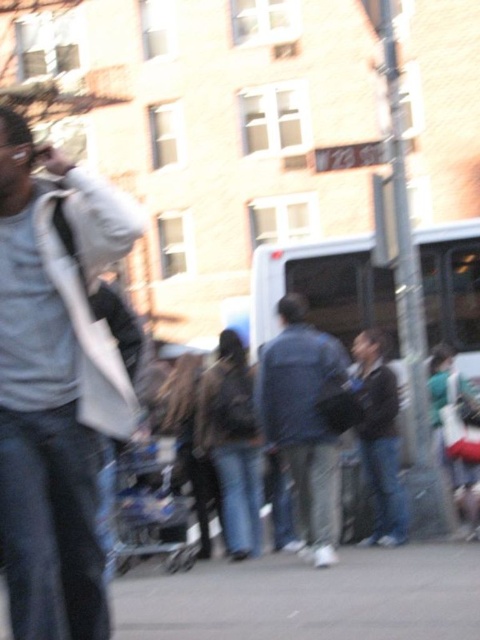
Describe the element at coordinates (56, 384) in the screenshot. I see `white fabric bag at left` at that location.

Which of these two, white fabric bag at left or gray asphalt pavement at lower center, stands shorter?

With less height is gray asphalt pavement at lower center.

Describe the element at coordinates (56, 384) in the screenshot. I see `white fabric bag at left` at that location.

You are a GUI agent. You are given a task and a screenshot of the screen. Output one action in this format:
    pyautogui.click(x=<x>, y=<y>)
    Task: Click on the white fabric bag at left
    Image resolution: width=480 pixels, height=640 pixels.
    Given the screenshot: What is the action you would take?
    pyautogui.click(x=56, y=384)

Does white fabric bag at left have a lesser width compared to denim jacket at center?

Yes.

Who is shorter, white fabric bag at left or denim jacket at center?

With less height is white fabric bag at left.

Image resolution: width=480 pixels, height=640 pixels. Describe the element at coordinates (56, 384) in the screenshot. I see `white fabric bag at left` at that location.

You are a GUI agent. You are given a task and a screenshot of the screen. Output one action in this format:
    pyautogui.click(x=<x>, y=<y>)
    Task: Click on the white fabric bag at left
    Image resolution: width=480 pixels, height=640 pixels.
    Given the screenshot: What is the action you would take?
    (56, 384)

Is gray asphalt pavement at lower center above denim jacket at center?

Actually, gray asphalt pavement at lower center is below denim jacket at center.

Which of these two, gray asphalt pavement at lower center or denim jacket at center, stands taller?

Standing taller between the two is denim jacket at center.

At what (x,y) coordinates should I click in order to perform the action: click on gray asphalt pavement at lower center. Please return your answer as a coordinate pair (x, y). This screenshot has height=640, width=480. Looking at the image, I should click on (310, 596).

I want to click on gray asphalt pavement at lower center, so click(310, 596).